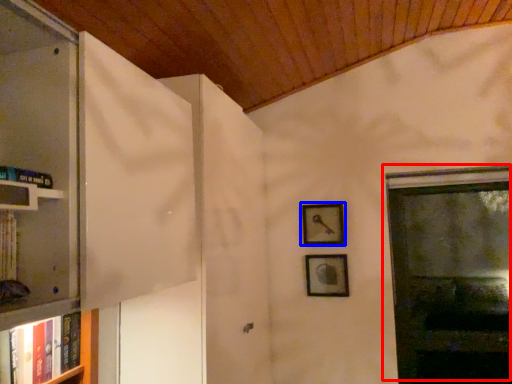
Question: Which object appears closest to the camera in this image, window (highlighted by a red box) or picture frame (highlighted by a blue box)?

Choices:
 (A) window
 (B) picture frame

Answer: (A)